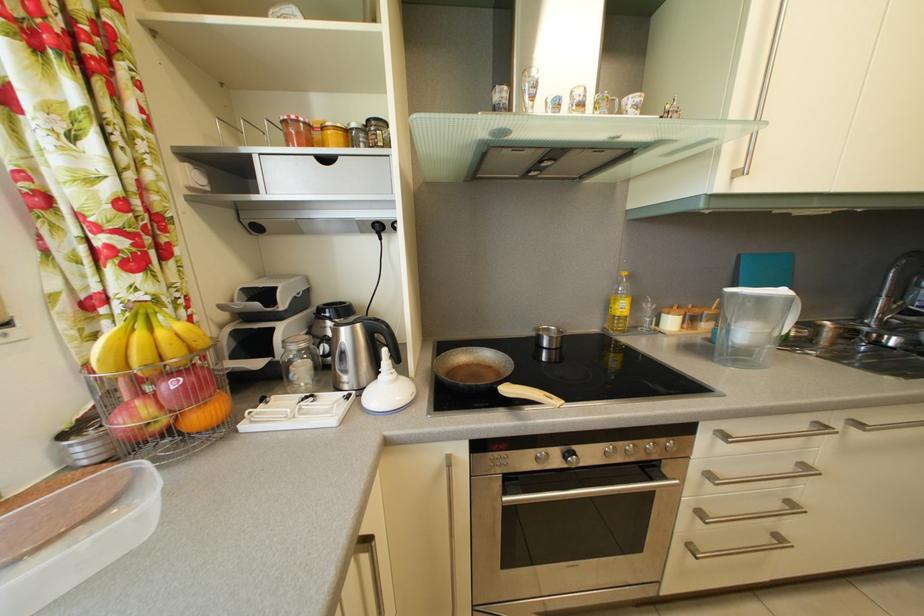
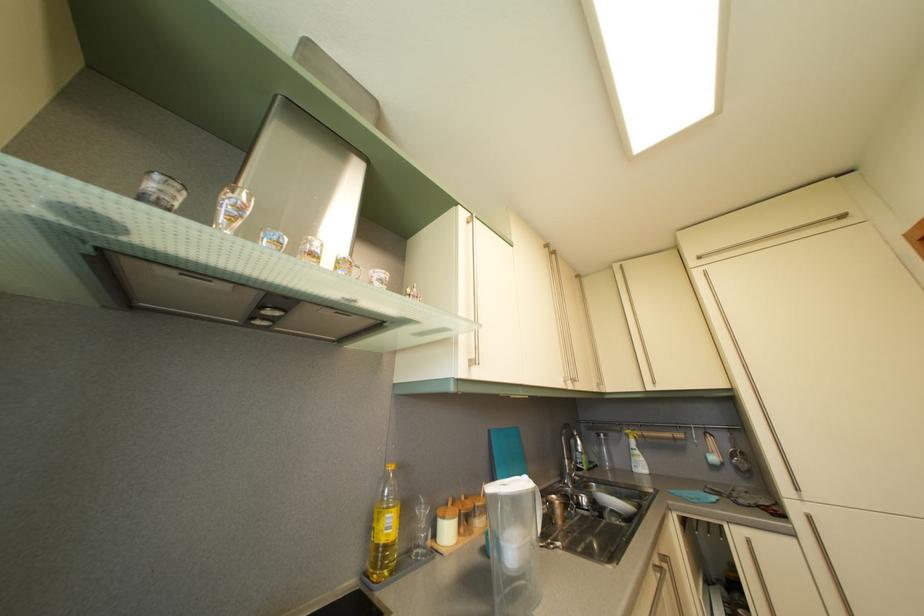
In the second image, find the point that corresponds to point (674, 317) in the first image.

(448, 519)